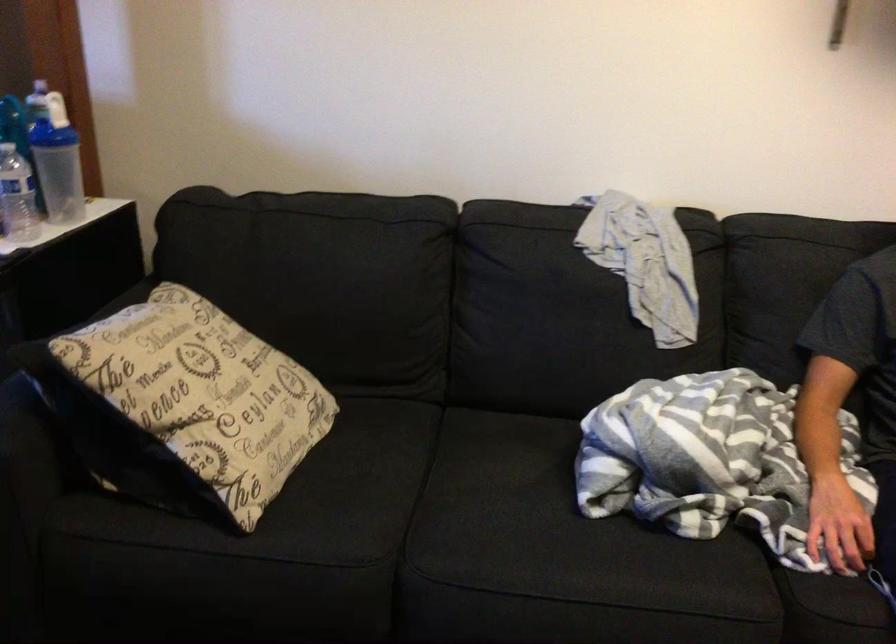
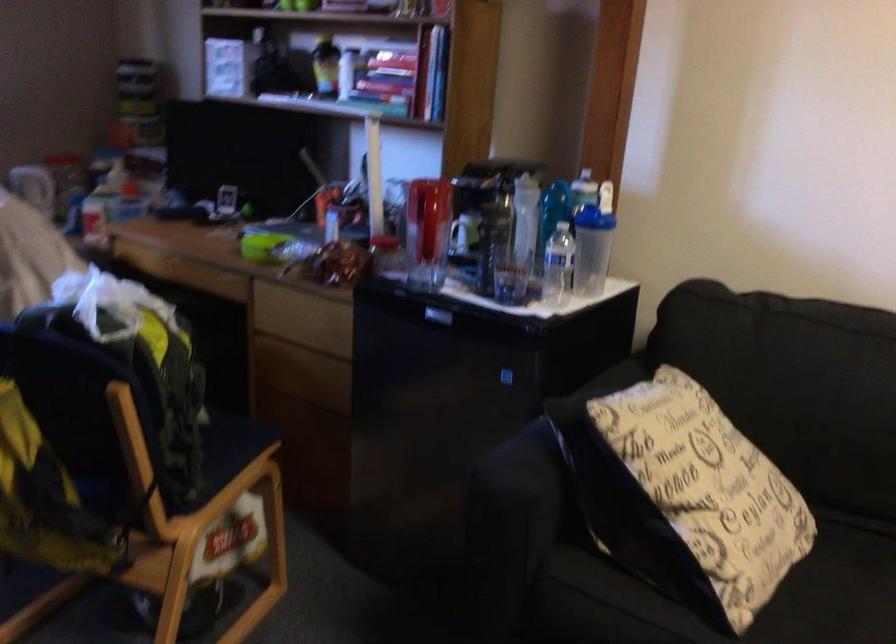
In the second image, find the point that corresponds to the point at 351,474 in the first image.

(842, 603)